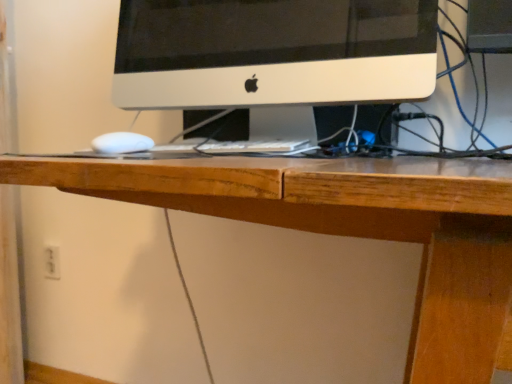
Question: Is white plastic electric outlet at lower left next to white matte computer monitor at center and touching it?

Choices:
 (A) no
 (B) yes

Answer: (A)

Question: Can you confirm if white plastic electric outlet at lower left is taller than white matte computer monitor at center?

Choices:
 (A) no
 (B) yes

Answer: (A)

Question: Does white plastic electric outlet at lower left appear on the left side of white matte computer monitor at center?

Choices:
 (A) yes
 (B) no

Answer: (A)

Question: Can white matte computer monitor at center be found inside white plastic electric outlet at lower left?

Choices:
 (A) no
 (B) yes

Answer: (A)

Question: Is white plastic electric outlet at lower left outside white matte computer monitor at center?

Choices:
 (A) no
 (B) yes

Answer: (B)

Question: From a real-world perspective, is white plastic electric outlet at lower left positioned over white matte computer monitor at center based on gravity?

Choices:
 (A) yes
 (B) no

Answer: (B)

Question: From a real-world perspective, is white matte computer monitor at center beneath white plastic electric outlet at lower left?

Choices:
 (A) yes
 (B) no

Answer: (B)

Question: Considering the relative positions of white matte computer monitor at center and white plastic electric outlet at lower left in the image provided, is white matte computer monitor at center to the left of white plastic electric outlet at lower left from the viewer's perspective?

Choices:
 (A) yes
 (B) no

Answer: (B)

Question: Considering the relative sizes of white matte computer monitor at center and white plastic electric outlet at lower left in the image provided, is white matte computer monitor at center smaller than white plastic electric outlet at lower left?

Choices:
 (A) no
 (B) yes

Answer: (A)

Question: From the image's perspective, is white matte computer monitor at center over white plastic electric outlet at lower left?

Choices:
 (A) yes
 (B) no

Answer: (A)

Question: Are white matte computer monitor at center and white plastic electric outlet at lower left far apart?

Choices:
 (A) yes
 (B) no

Answer: (B)

Question: Is white matte computer monitor at center to the right of white plastic electric outlet at lower left from the viewer's perspective?

Choices:
 (A) no
 (B) yes

Answer: (B)

Question: In terms of size, does white plastic electric outlet at lower left appear bigger or smaller than white matte computer monitor at center?

Choices:
 (A) big
 (B) small

Answer: (B)